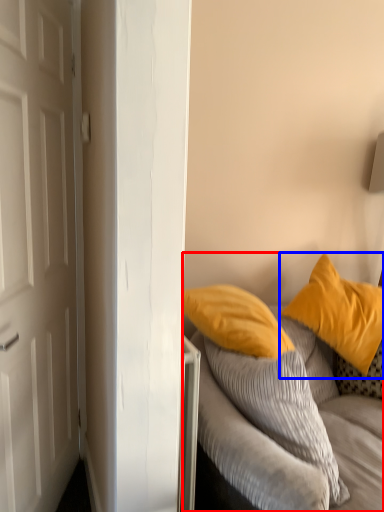
Question: Which of the following is the closest to the observer, studio couch (highlighted by a red box) or pillow (highlighted by a blue box)?

Choices:
 (A) studio couch
 (B) pillow

Answer: (A)